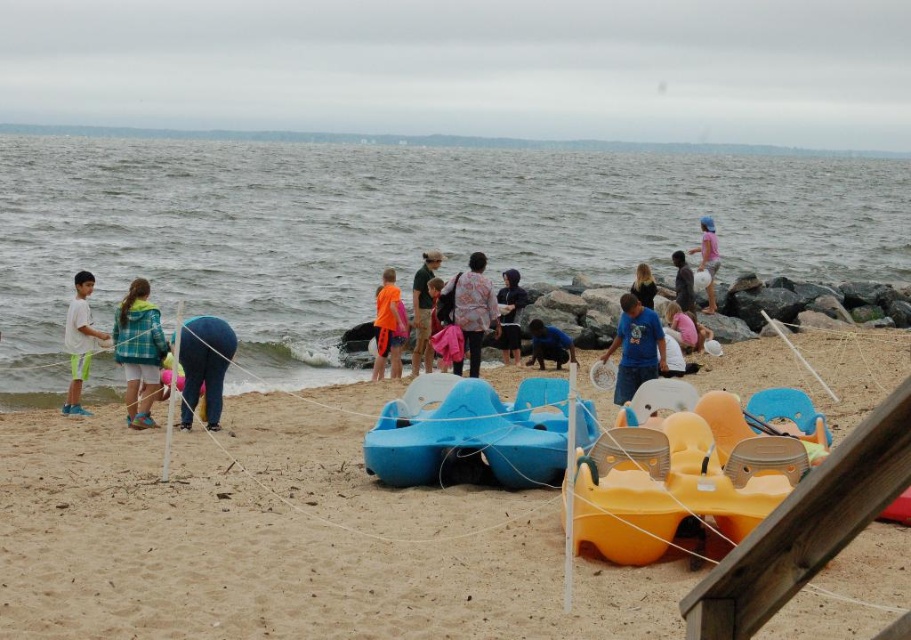
Question: Can you confirm if green plaid jacket at center is smaller than blue fabric at center?

Choices:
 (A) no
 (B) yes

Answer: (B)

Question: Is blue fabric at center to the right of pink fabric dress at upper center from the viewer's perspective?

Choices:
 (A) yes
 (B) no

Answer: (B)

Question: Which object is farther from the camera taking this photo?

Choices:
 (A) blue fabric at center
 (B) blonde hair at upper center
 (C) floral fabric dress at center
 (D) matte green shirt at center

Answer: (A)

Question: Among these points, which one is farthest from the camera?

Choices:
 (A) (97, 243)
 (B) (709, 280)
 (C) (134, 540)

Answer: (A)

Question: Does smooth sand at lower left appear on the right side of floral fabric dress at center?

Choices:
 (A) yes
 (B) no

Answer: (A)

Question: Which object is the farthest from the matte green shirt at center?

Choices:
 (A) gray water at lower left
 (B) blue denim jeans at lower left

Answer: (A)